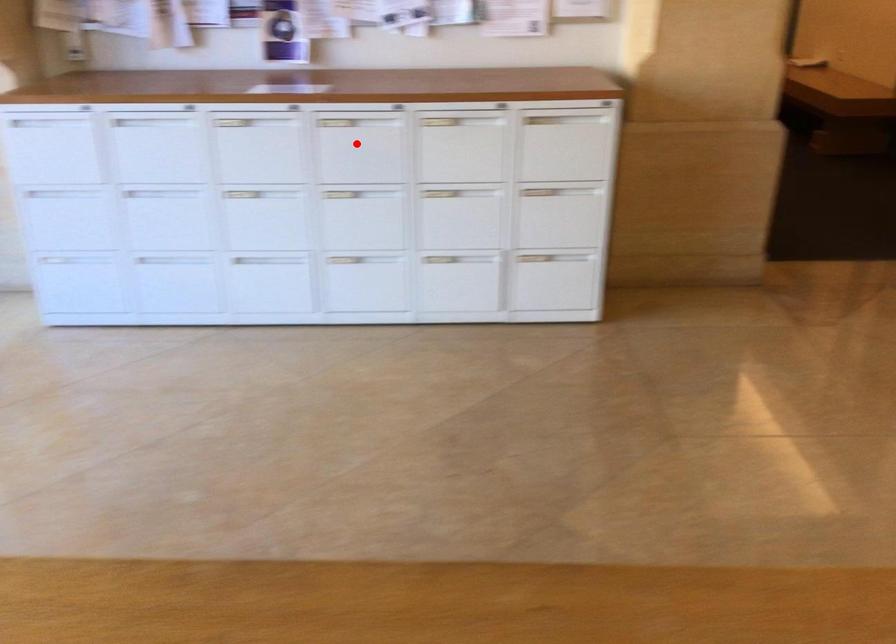
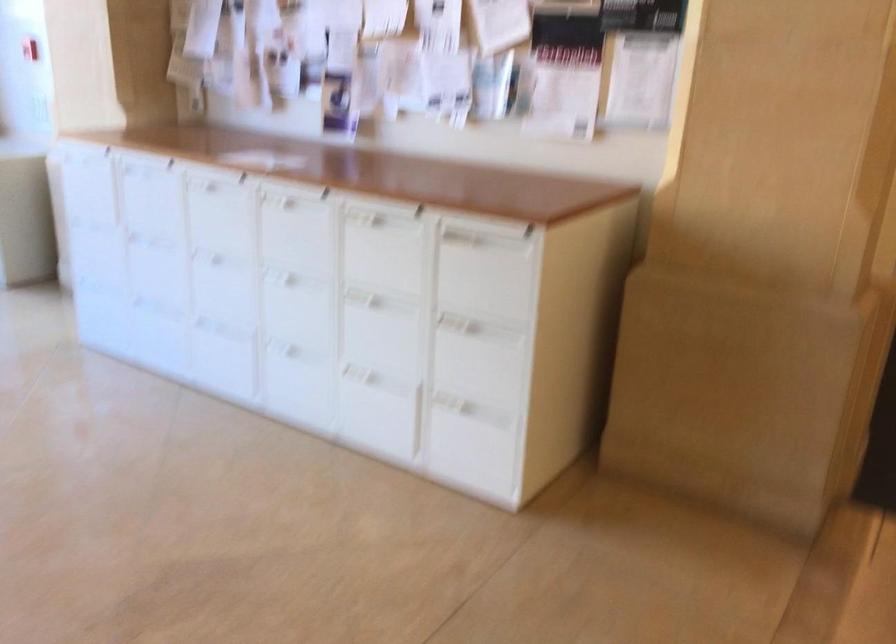
Locate, in the second image, the point that corresponds to the highlighted location in the first image.

(295, 228)